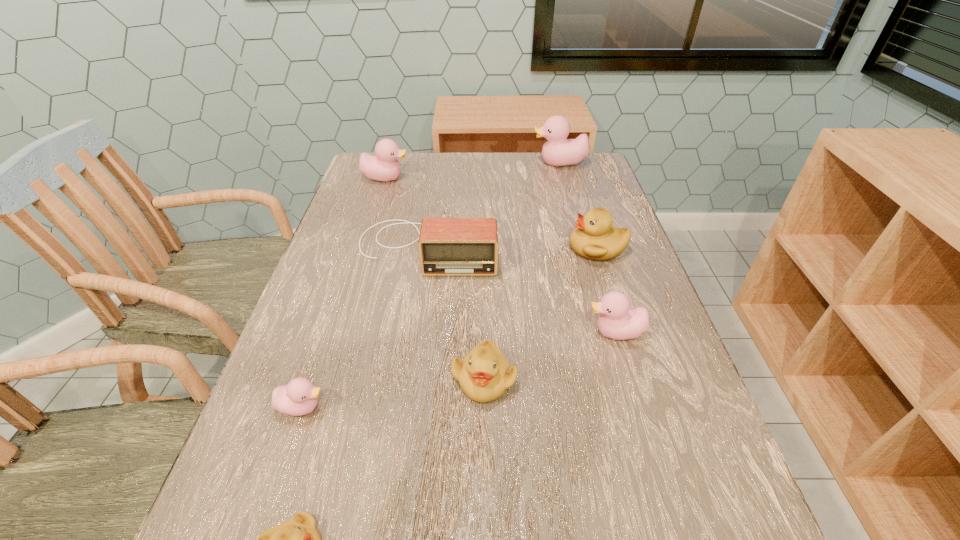
This screenshot has width=960, height=540. Identify the location of duckling that is the nearest to the nearest yellow duckling. (299, 397).

Select which pink duckling is the second closest to the nearest yellow duckling. Please provide its 2D coordinates. Your answer should be formatted as a tuple, i.e. [(x, y)], where the tuple contains the x and y coordinates of a point satisfying the conditions above.

[(618, 321)]

In order to click on pink duckling that can be found as the closest to the smallest yellow duckling in this screenshot , I will do (299, 397).

Find the location of a particular element. The image size is (960, 540). the second closest yellow duckling to the smallest pink duckling is located at coordinates (484, 374).

Select which yellow duckling is the closest to the biggest yellow duckling. Please provide its 2D coordinates. Your answer should be formatted as a tuple, i.e. [(x, y)], where the tuple contains the x and y coordinates of a point satisfying the conditions above.

[(484, 374)]

Image resolution: width=960 pixels, height=540 pixels. What are the coordinates of `free space that satisfies the following two spatial constraints: 1. on the front-facing side of the fourth nearest duckling; 2. on the front-facing side of the second yellow duckling from right to left` in the screenshot? It's located at (630, 379).